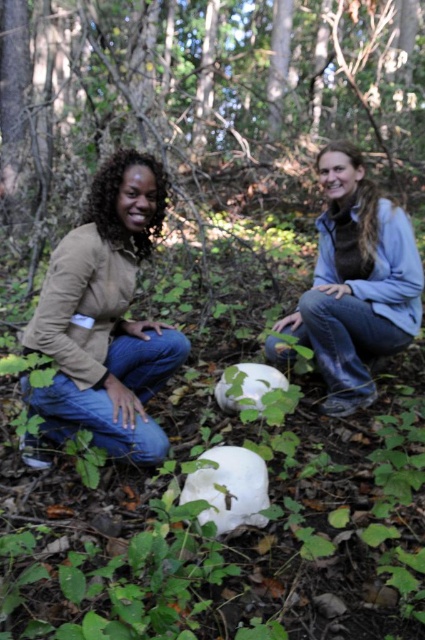
Between rough bark tree at center and matte beige sweater at lower left, which one has less height?

Standing shorter between the two is matte beige sweater at lower left.

Can you confirm if rough bark tree at center is positioned above matte beige sweater at lower left?

Yes, rough bark tree at center is above matte beige sweater at lower left.

You are a GUI agent. You are given a task and a screenshot of the screen. Output one action in this format:
    pyautogui.click(x=<x>, y=<y>)
    Task: Click on the rough bark tree at center
    The height and width of the screenshot is (640, 425).
    Given the screenshot: What is the action you would take?
    pyautogui.click(x=201, y=99)

Is rough bark tree at center shorter than white matte pumpkin at center?

In fact, rough bark tree at center may be taller than white matte pumpkin at center.

Is rough bark tree at center to the right of white matte pumpkin at center from the viewer's perspective?

In fact, rough bark tree at center is to the left of white matte pumpkin at center.

This screenshot has height=640, width=425. Identify the location of rough bark tree at center. pos(201,99).

This screenshot has width=425, height=640. Identify the location of rough bark tree at center. (201, 99).

Can you confirm if matte beige sweater at lower left is bigger than white matte pumpkin at center?

Actually, matte beige sweater at lower left might be smaller than white matte pumpkin at center.

Is point (144, 236) closer to viewer compared to point (362, 342)?

Yes, point (144, 236) is in front of point (362, 342).

You are a GUI agent. You are given a task and a screenshot of the screen. Output one action in this format:
    pyautogui.click(x=<x>, y=<y>)
    Task: Click on the matte beige sweater at lower left
    The width and height of the screenshot is (425, 640).
    Given the screenshot: What is the action you would take?
    pyautogui.click(x=105, y=317)